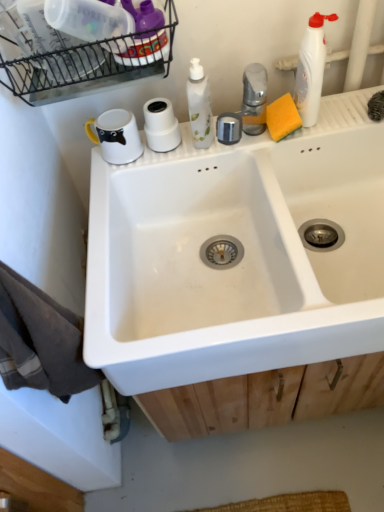
Identify the location of vacant area that is in front of white matte toilet paper at upper center. This screenshot has height=512, width=384. (158, 166).